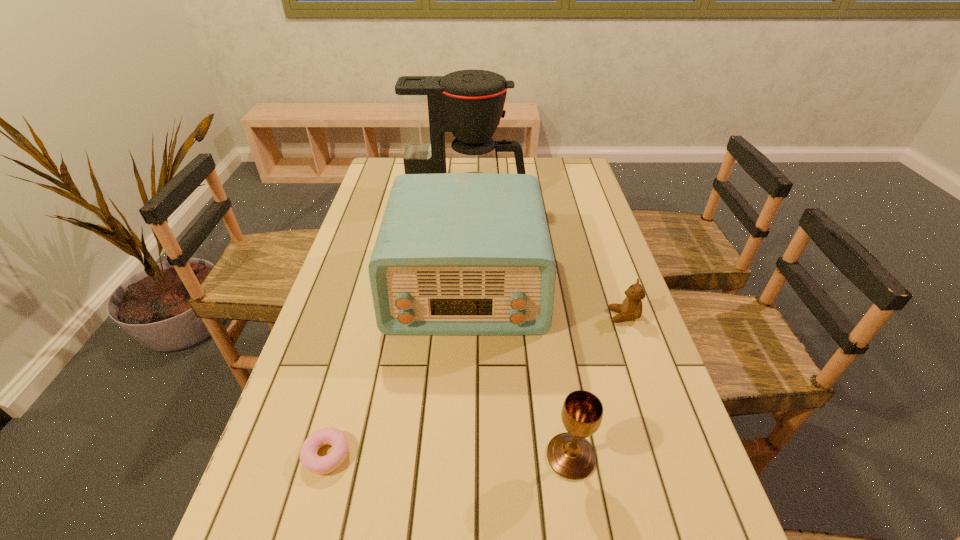
I want to click on object located at the far left corner, so click(469, 103).

Locate an element on the screen. The height and width of the screenshot is (540, 960). vacant region at the far edge of the desktop is located at coordinates (504, 166).

Identify the location of vacant space at the left edge. This screenshot has height=540, width=960. (386, 207).

In the image, there is a desktop. What are the coordinates of `vacant space at the right edge` in the screenshot? It's located at (561, 212).

Where is `free space between the fourth tallest object and the shortest object`? The width and height of the screenshot is (960, 540). free space between the fourth tallest object and the shortest object is located at coordinates (475, 386).

Identify the location of vacant space that is in between the shortest object and the second tallest object. (396, 370).

This screenshot has width=960, height=540. I want to click on empty space between the chalice and the second tallest object, so click(518, 371).

Identify the location of unoccupied area between the teddy bear and the chalice. The height and width of the screenshot is (540, 960). (597, 386).

The width and height of the screenshot is (960, 540). Find the location of `empty space between the third tallest object and the doughnut`. empty space between the third tallest object and the doughnut is located at coordinates (449, 456).

Locate which object is the closest to the leftmost object. Please provide its 2D coordinates. Your answer should be formatted as a tuple, i.e. [(x, y)], where the tuple contains the x and y coordinates of a point satisfying the conditions above.

[(457, 254)]